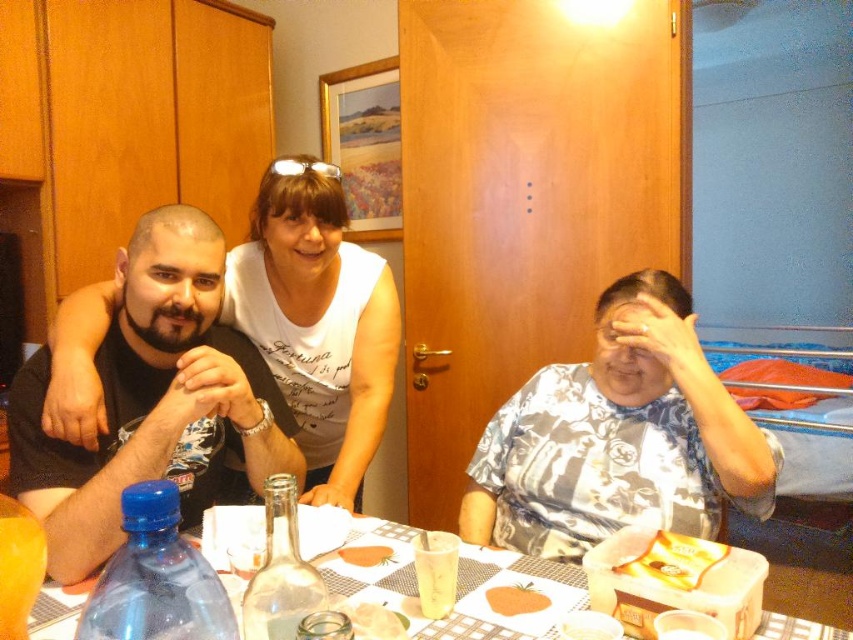
You are a guest at this gathering and want to grab a drink. The transparent glass bottle at center and the yellow matte snack packet at lower right are both on the table. Which one is closer to your left side?

The transparent glass bottle at center is to the left of yellow matte snack packet at lower right, so it is closer to your left side.

You are organizing a small gathering and need to place a decorative centerpiece on the table. Considering the current setup, can you place it on the white plastic table at center without moving the white floral shirt at lower right?

The white floral shirt at lower right is positioned over the white plastic table at center, so placing a centerpiece there would require moving the shirt first.